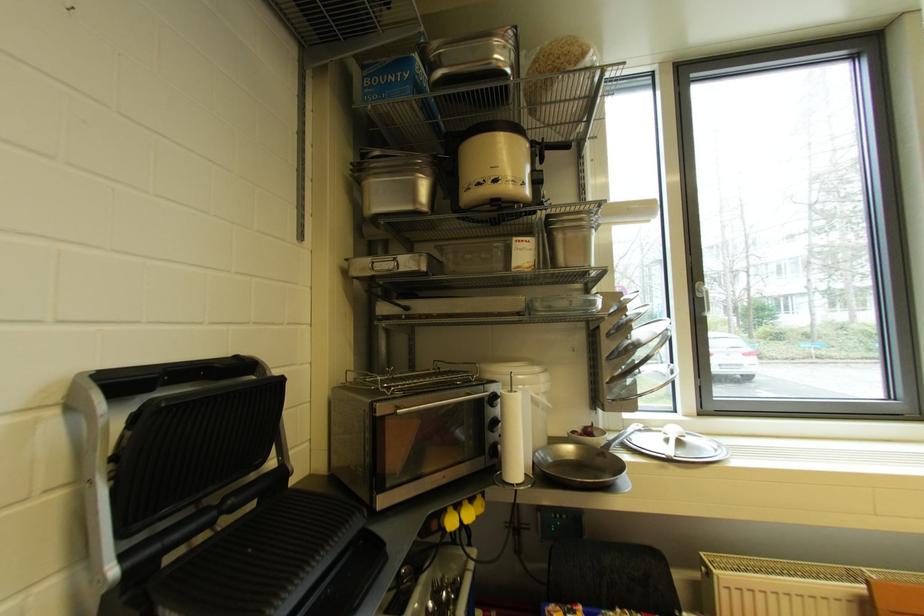
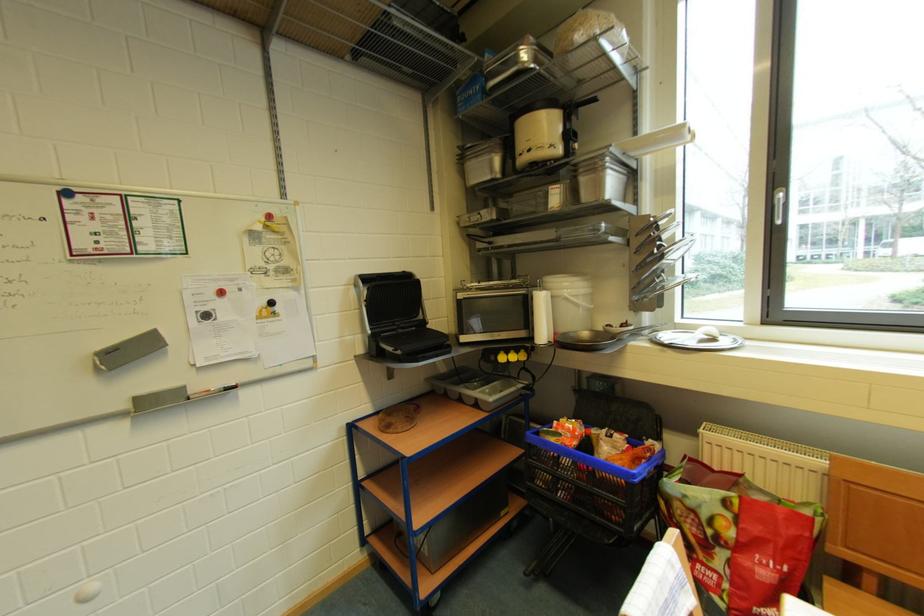
Question: How did the camera likely rotate?

Choices:
 (A) Left
 (B) Right
 (C) Up
 (D) Down

Answer: (A)